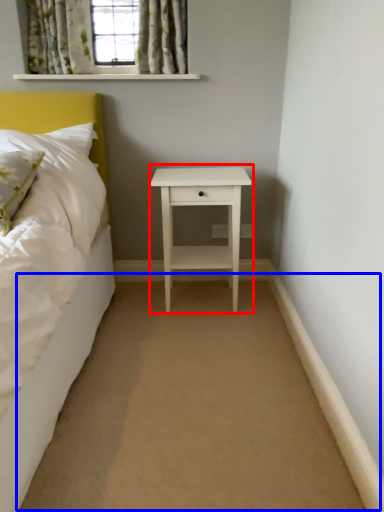
Question: Which of the following is the farthest to the observer, nightstand (highlighted by a red box) or plain (highlighted by a blue box)?

Choices:
 (A) nightstand
 (B) plain

Answer: (A)